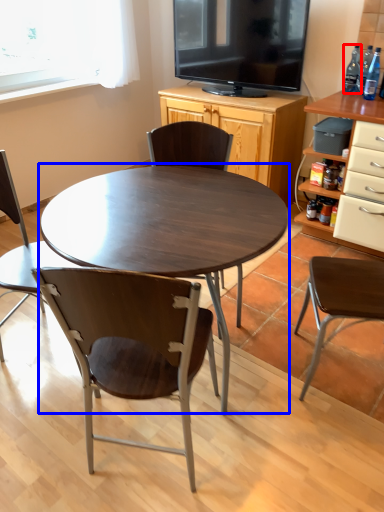
Question: Among these objects, which one is farthest to the camera, bottle (highlighted by a red box) or coffee table (highlighted by a blue box)?

Choices:
 (A) bottle
 (B) coffee table

Answer: (A)